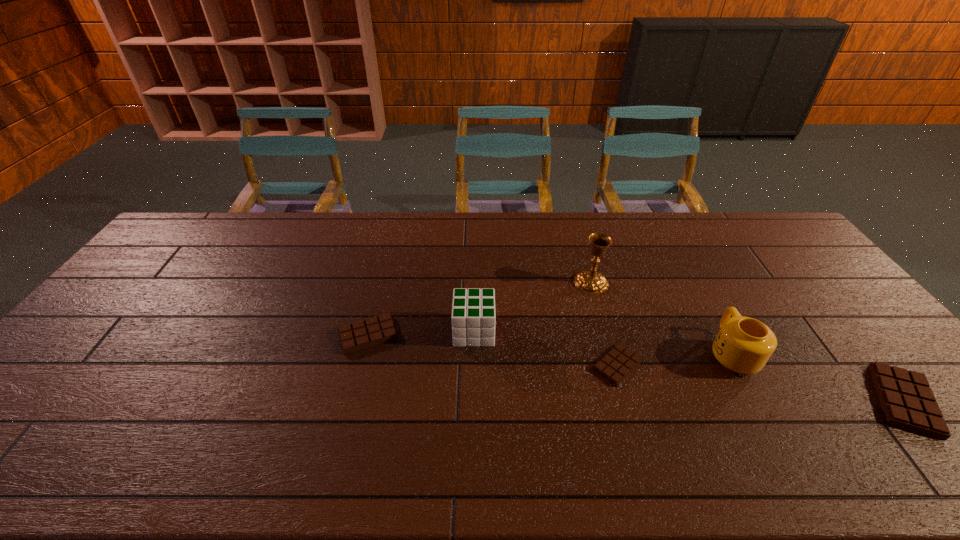
Select which object appears as the fifth closest to the mug. Please provide its 2D coordinates. Your answer should be formatted as a tuple, i.e. [(x, y)], where the tuple contains the x and y coordinates of a point satisfying the conditions above.

[(358, 335)]

Find the location of a particular element. This screenshot has height=540, width=960. candy bar that stands as the second closest to the mug is located at coordinates (907, 401).

Image resolution: width=960 pixels, height=540 pixels. What are the coordinates of `candy bar that is the closest to the second candy bar from left to right` in the screenshot? It's located at (358, 335).

At what (x,y) coordinates should I click in order to perform the action: click on free region that satisfies the following two spatial constraints: 1. on the front side of the second candy bar from left to right; 2. on the right side of the tallest object. Please return your answer as a coordinate pair (x, y). Looking at the image, I should click on [614, 365].

Locate an element on the screen. free space that satisfies the following two spatial constraints: 1. on the red face of the shortest object; 2. on the right side of the cube is located at coordinates (473, 365).

What are the coordinates of `vacant space that satisfies the following two spatial constraints: 1. on the front side of the shortest candy bar; 2. on the left side of the tallest object` in the screenshot? It's located at (614, 365).